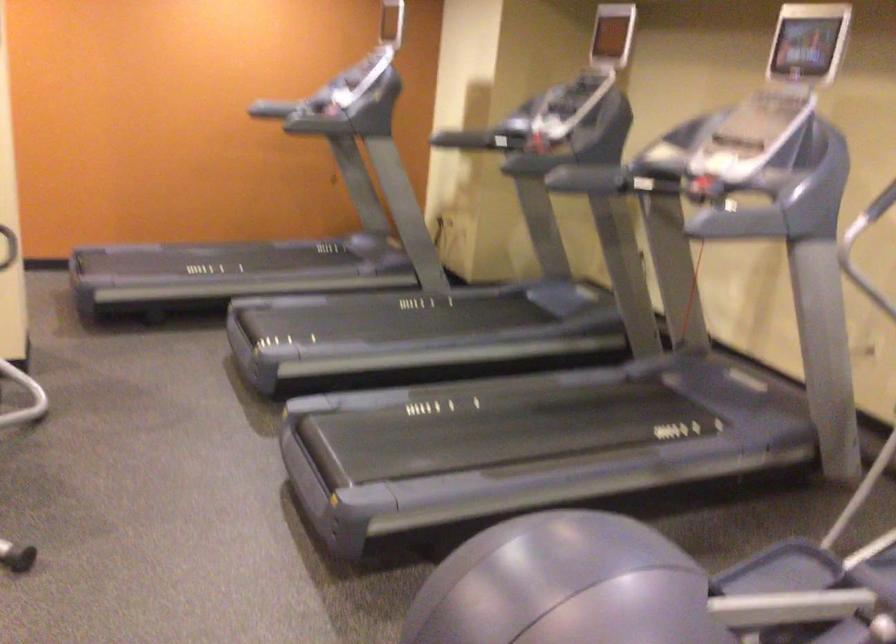
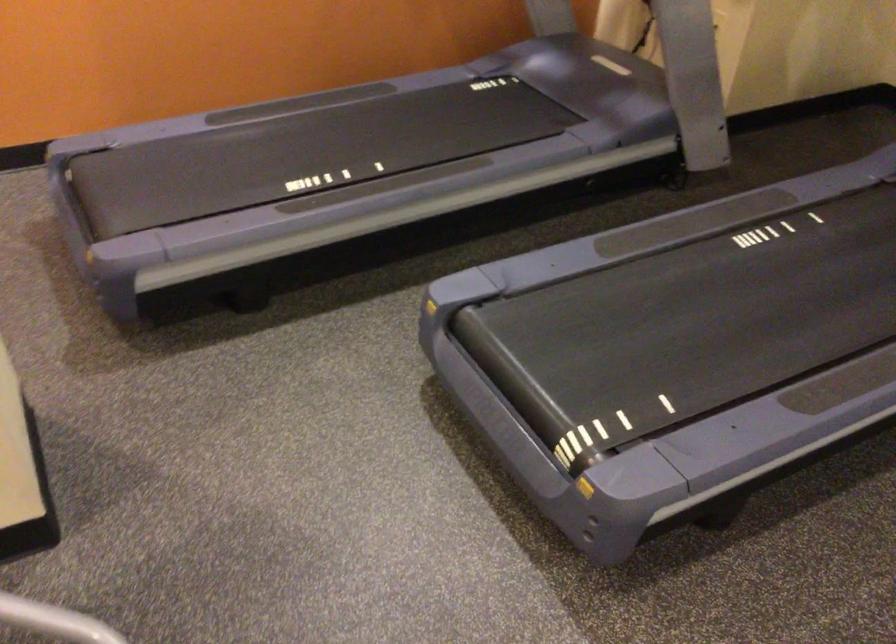
Find the pixel in the second image that matches (221,241) in the first image.

(294, 104)